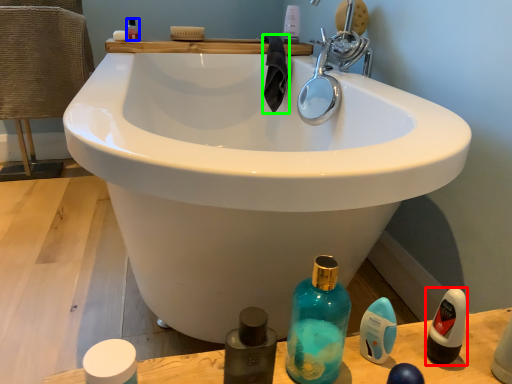
Question: Which object is the farthest from mouthwash (highlighted by a red box)? Choose among these: mouthwash (highlighted by a blue box) or material (highlighted by a green box).

Choices:
 (A) mouthwash
 (B) material

Answer: (A)